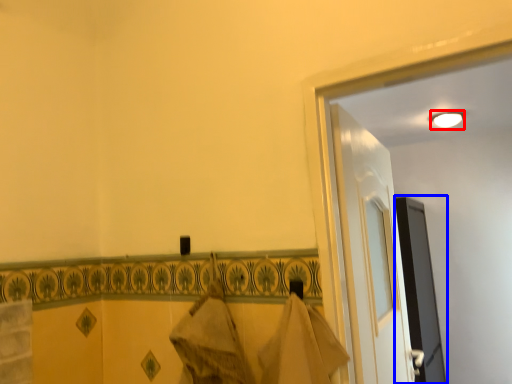
Question: Which of the following is the closest to the observer, light (highlighted by a red box) or screen door (highlighted by a blue box)?

Choices:
 (A) light
 (B) screen door

Answer: (B)